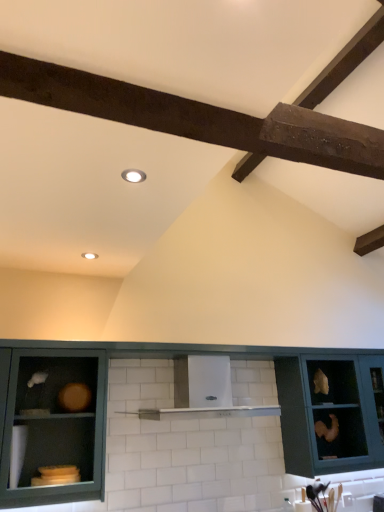
This screenshot has height=512, width=384. What do you see at coordinates (205, 391) in the screenshot? I see `white glossy vent at center` at bounding box center [205, 391].

The image size is (384, 512). What are the coordinates of `white glossy vent at center` in the screenshot? It's located at (205, 391).

Is point (196, 364) more distant than point (281, 411)?

No, (196, 364) is in front of (281, 411).

Based on the photo, from the image's perspective, is white glossy vent at center on matte teal cabinet at right, the third cabinetry in the left-to-right sequence?

Yes, from the image's perspective, white glossy vent at center is over matte teal cabinet at right, the third cabinetry in the left-to-right sequence.

Is white glossy vent at center positioned far away from matte teal cabinet at right, the third cabinetry in the left-to-right sequence?

No, white glossy vent at center is not far from matte teal cabinet at right, the third cabinetry in the left-to-right sequence.

Considering the relative positions of white glossy vent at center and matte teal cabinet at right, the third cabinetry in the left-to-right sequence, in the image provided, is white glossy vent at center behind matte teal cabinet at right, the third cabinetry in the left-to-right sequence,?

No, the depth of white glossy vent at center is less than that of matte teal cabinet at right, the third cabinetry in the left-to-right sequence.

What's the angular difference between white glossy vent at center and matte green cabinet at lower left, positioned as the third cabinetry in right-to-left order,'s facing directions?

The facing directions of white glossy vent at center and matte green cabinet at lower left, positioned as the third cabinetry in right-to-left order, are 0.453 degrees apart.

Is white glossy vent at center in front of or behind matte green cabinet at lower left, positioned as the third cabinetry in right-to-left order, in the image?

white glossy vent at center is behind matte green cabinet at lower left, positioned as the third cabinetry in right-to-left order.

Is white glossy vent at center positioned far away from matte green cabinet at lower left, acting as the 1th cabinetry starting from the left?

white glossy vent at center is actually quite close to matte green cabinet at lower left, acting as the 1th cabinetry starting from the left.

Which object is positioned more to the left, white glossy vent at center or matte green cabinet at lower left, acting as the 1th cabinetry starting from the left?

From the viewer's perspective, matte green cabinet at lower left, acting as the 1th cabinetry starting from the left, appears more on the left side.

How far apart are matte green cabinet at lower left, positioned as the third cabinetry in right-to-left order, and matte teal cabinet at right, which ranks as the 1th cabinetry in right-to-left order?

matte green cabinet at lower left, positioned as the third cabinetry in right-to-left order, and matte teal cabinet at right, which ranks as the 1th cabinetry in right-to-left order, are 1.59 meters apart.

In the scene shown: Does matte green cabinet at lower left, positioned as the third cabinetry in right-to-left order, come in front of matte teal cabinet at right, which ranks as the 1th cabinetry in right-to-left order?

Yes, it is in front of matte teal cabinet at right, which ranks as the 1th cabinetry in right-to-left order.

Is matte green cabinet at lower left, positioned as the third cabinetry in right-to-left order, outside of matte teal cabinet at right, which ranks as the 1th cabinetry in right-to-left order?

That's correct, matte green cabinet at lower left, positioned as the third cabinetry in right-to-left order, is outside of matte teal cabinet at right, which ranks as the 1th cabinetry in right-to-left order.

Can you confirm if matte green cabinet at lower left, positioned as the third cabinetry in right-to-left order, is smaller than matte teal cabinet at right, the third cabinetry in the left-to-right sequence?

Yes.

Is matte teal cabinet at right, the third cabinetry in the left-to-right sequence, inside matte teal cabinet at center, the 2th cabinetry in the left-to-right sequence?

Actually, matte teal cabinet at right, the third cabinetry in the left-to-right sequence, is outside matte teal cabinet at center, the 2th cabinetry in the left-to-right sequence.

From the picture: Can you confirm if matte teal cabinet at center, placed as the 2th cabinetry when sorted from right to left, is shorter than matte teal cabinet at right, which ranks as the 1th cabinetry in right-to-left order?

In fact, matte teal cabinet at center, placed as the 2th cabinetry when sorted from right to left, may be taller than matte teal cabinet at right, which ranks as the 1th cabinetry in right-to-left order.

From the picture: Is the surface of matte teal cabinet at center, the 2th cabinetry in the left-to-right sequence, in direct contact with matte teal cabinet at right, the third cabinetry in the left-to-right sequence?

No, matte teal cabinet at center, the 2th cabinetry in the left-to-right sequence, is not touching matte teal cabinet at right, the third cabinetry in the left-to-right sequence.

Considering the sizes of matte teal cabinet at center, the 2th cabinetry in the left-to-right sequence, and matte teal cabinet at right, the third cabinetry in the left-to-right sequence, in the image, is matte teal cabinet at center, the 2th cabinetry in the left-to-right sequence, bigger or smaller than matte teal cabinet at right, the third cabinetry in the left-to-right sequence,?

In the image, matte teal cabinet at center, the 2th cabinetry in the left-to-right sequence, appears to be smaller than matte teal cabinet at right, the third cabinetry in the left-to-right sequence.

Who is taller, matte teal cabinet at center, the 2th cabinetry in the left-to-right sequence, or white glossy vent at center?

matte teal cabinet at center, the 2th cabinetry in the left-to-right sequence.

From a real-world perspective, count 3rd cabinetrys downward from the white glossy vent at center and point to it. Please provide its 2D coordinates.

[(163, 411)]

Based on the photo, from a real-world perspective, which object rests below the other?

In real-world perspective, matte teal cabinet at center, the 2th cabinetry in the left-to-right sequence, is lower.

From the image's perspective, is matte teal cabinet at center, placed as the 2th cabinetry when sorted from right to left, located above white glossy vent at center?

Incorrect, from the image's perspective, matte teal cabinet at center, placed as the 2th cabinetry when sorted from right to left, is lower than white glossy vent at center.

Starting from the white glossy vent at center, which cabinetry is the 2nd one to the right? Please provide its 2D coordinates.

[(328, 414)]

Could white glossy vent at center be considered to be inside matte teal cabinet at right, which ranks as the 1th cabinetry in right-to-left order?

Actually, white glossy vent at center is outside matte teal cabinet at right, which ranks as the 1th cabinetry in right-to-left order.

Is matte teal cabinet at right, the third cabinetry in the left-to-right sequence, not close to white glossy vent at center?

No, there isn't a large distance between matte teal cabinet at right, the third cabinetry in the left-to-right sequence, and white glossy vent at center.

Is matte teal cabinet at right, the third cabinetry in the left-to-right sequence, facing towards white glossy vent at center?

No, matte teal cabinet at right, the third cabinetry in the left-to-right sequence, is not facing towards white glossy vent at center.

Image resolution: width=384 pixels, height=512 pixels. Find the location of `the 3rd cabinetry below the white glossy vent at center (from the image's perspective)`. the 3rd cabinetry below the white glossy vent at center (from the image's perspective) is located at coordinates (163, 411).

Which object is positioned more to the right, white glossy vent at center or matte teal cabinet at center, the 2th cabinetry in the left-to-right sequence?

matte teal cabinet at center, the 2th cabinetry in the left-to-right sequence, is more to the right.

Locate an element on the screen. shelf lying on the left of matte teal cabinet at right, which ranks as the 1th cabinetry in right-to-left order is located at coordinates (205, 391).

Find the location of a particular element. Image resolution: width=384 pixels, height=512 pixels. the 2nd cabinetry located beneath the white glossy vent at center (from a real-world perspective) is located at coordinates (52, 425).

Which object lies nearer to the anchor point matte teal cabinet at right, the third cabinetry in the left-to-right sequence, matte teal cabinet at center, placed as the 2th cabinetry when sorted from right to left, or matte green cabinet at lower left, positioned as the third cabinetry in right-to-left order?

Among the two, matte teal cabinet at center, placed as the 2th cabinetry when sorted from right to left, is located nearer to matte teal cabinet at right, the third cabinetry in the left-to-right sequence.

Estimate the real-world distances between objects in this image. Which object is closer to matte teal cabinet at right, which ranks as the 1th cabinetry in right-to-left order, white glossy vent at center or matte green cabinet at lower left, positioned as the third cabinetry in right-to-left order?

white glossy vent at center is closer to matte teal cabinet at right, which ranks as the 1th cabinetry in right-to-left order.

Based on their spatial positions, is white glossy vent at center or matte green cabinet at lower left, positioned as the third cabinetry in right-to-left order, further from matte teal cabinet at center, placed as the 2th cabinetry when sorted from right to left?

white glossy vent at center.

Looking at the image, which one is located closer to matte teal cabinet at center, placed as the 2th cabinetry when sorted from right to left, matte green cabinet at lower left, positioned as the third cabinetry in right-to-left order, or matte teal cabinet at right, which ranks as the 1th cabinetry in right-to-left order?

The object closer to matte teal cabinet at center, placed as the 2th cabinetry when sorted from right to left, is matte green cabinet at lower left, positioned as the third cabinetry in right-to-left order.

Which object lies further to the anchor point matte green cabinet at lower left, positioned as the third cabinetry in right-to-left order, matte teal cabinet at right, which ranks as the 1th cabinetry in right-to-left order, or white glossy vent at center?

matte teal cabinet at right, which ranks as the 1th cabinetry in right-to-left order, is positioned further to the anchor matte green cabinet at lower left, positioned as the third cabinetry in right-to-left order.

In the scene shown: Which object lies nearer to the anchor point white glossy vent at center, matte teal cabinet at right, the third cabinetry in the left-to-right sequence, or matte teal cabinet at center, placed as the 2th cabinetry when sorted from right to left?

The object closer to white glossy vent at center is matte teal cabinet at center, placed as the 2th cabinetry when sorted from right to left.

Considering their positions, is matte teal cabinet at center, placed as the 2th cabinetry when sorted from right to left, positioned closer to matte teal cabinet at right, which ranks as the 1th cabinetry in right-to-left order, than white glossy vent at center?

The object closer to matte teal cabinet at right, which ranks as the 1th cabinetry in right-to-left order, is matte teal cabinet at center, placed as the 2th cabinetry when sorted from right to left.

Considering their positions, is matte teal cabinet at center, the 2th cabinetry in the left-to-right sequence, positioned closer to matte green cabinet at lower left, positioned as the third cabinetry in right-to-left order, than white glossy vent at center?

Among the two, matte teal cabinet at center, the 2th cabinetry in the left-to-right sequence, is located nearer to matte green cabinet at lower left, positioned as the third cabinetry in right-to-left order.

Locate an element on the screen. The height and width of the screenshot is (512, 384). cabinetry between matte green cabinet at lower left, positioned as the third cabinetry in right-to-left order, and matte teal cabinet at right, the third cabinetry in the left-to-right sequence, in the horizontal direction is located at coordinates pyautogui.click(x=163, y=411).

Locate an element on the screen. cabinetry situated between white glossy vent at center and matte teal cabinet at right, the third cabinetry in the left-to-right sequence, from left to right is located at coordinates (163, 411).

Where is `shelf situated between matte green cabinet at lower left, acting as the 1th cabinetry starting from the left, and matte teal cabinet at center, the 2th cabinetry in the left-to-right sequence, from left to right`? This screenshot has width=384, height=512. shelf situated between matte green cabinet at lower left, acting as the 1th cabinetry starting from the left, and matte teal cabinet at center, the 2th cabinetry in the left-to-right sequence, from left to right is located at coordinates (205, 391).

Where is `shelf situated between matte green cabinet at lower left, acting as the 1th cabinetry starting from the left, and matte teal cabinet at right, which ranks as the 1th cabinetry in right-to-left order, from left to right`? The height and width of the screenshot is (512, 384). shelf situated between matte green cabinet at lower left, acting as the 1th cabinetry starting from the left, and matte teal cabinet at right, which ranks as the 1th cabinetry in right-to-left order, from left to right is located at coordinates pos(205,391).